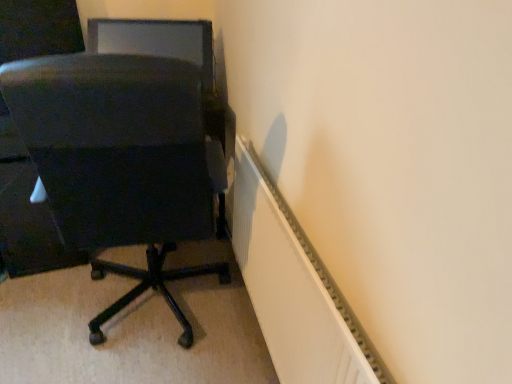
Question: From a real-world perspective, is white ribbed radiator at lower right positioned above or below matte black chair at left?

Choices:
 (A) below
 (B) above

Answer: (A)

Question: Based on their positions, is white ribbed radiator at lower right located to the left or right of matte black chair at left?

Choices:
 (A) right
 (B) left

Answer: (A)

Question: Estimate the real-world distances between objects in this image. Which object is farther from the white ribbed radiator at lower right?

Choices:
 (A) matte black chair at left
 (B) matte black monitor at upper left

Answer: (B)

Question: Which is farther from the matte black monitor at upper left?

Choices:
 (A) white ribbed radiator at lower right
 (B) matte black chair at left

Answer: (A)